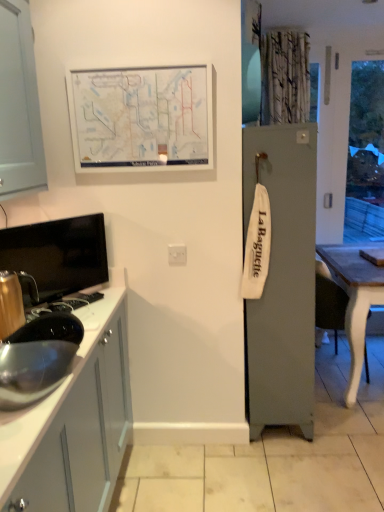
In order to click on vacant space underneath wooden table at right (from a real-world perspective) in this screenshot , I will do `click(331, 375)`.